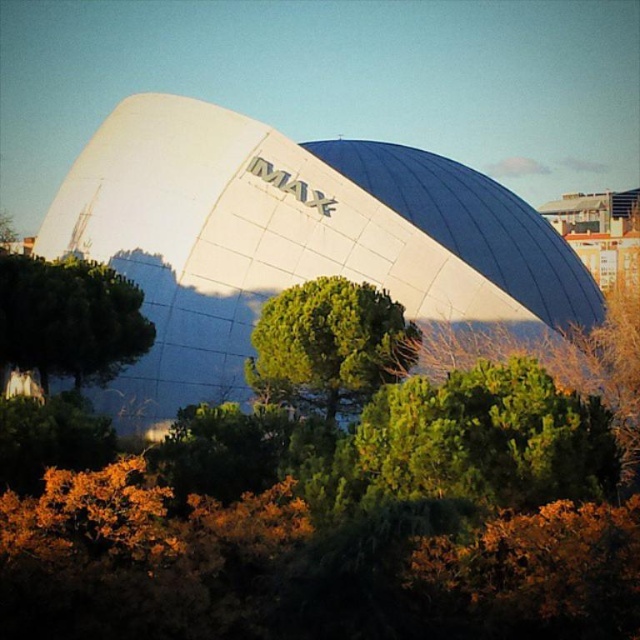
You are standing in front of the IMAX building and want to walk towards the green leafy tree at center. Which direction should you walk to avoid the green leafy tree at left?

Since the green leafy tree at center is closer to you than the green leafy tree at left, you should walk directly towards the green leafy tree at center. The green leafy tree at left is behind the green leafy tree at center, so walking straight ahead will naturally avoid it.

You are standing in front of the IMAX building and want to walk from the green leafy tree at left to the green leafy tree at center. How far will you have to walk?

The green leafy tree at center is 9.83 meters away from the green leafy tree at left, so you will have to walk 9.83 meters to reach the center tree from the left one.